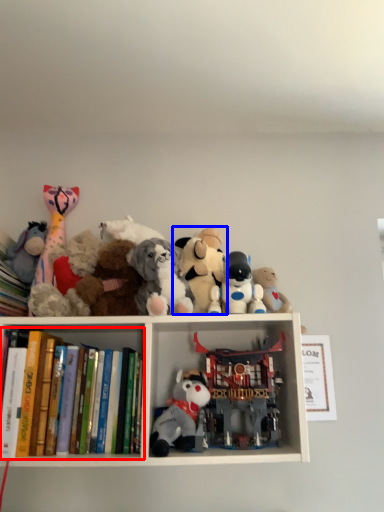
Question: Which object appears closest to the camera in this image, book (highlighted by a red box) or toy (highlighted by a blue box)?

Choices:
 (A) book
 (B) toy

Answer: (A)